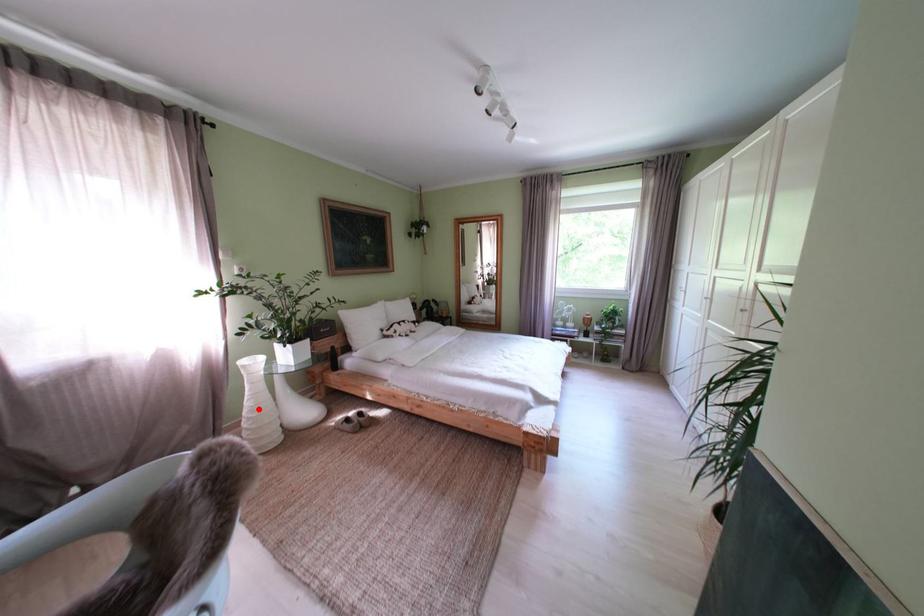
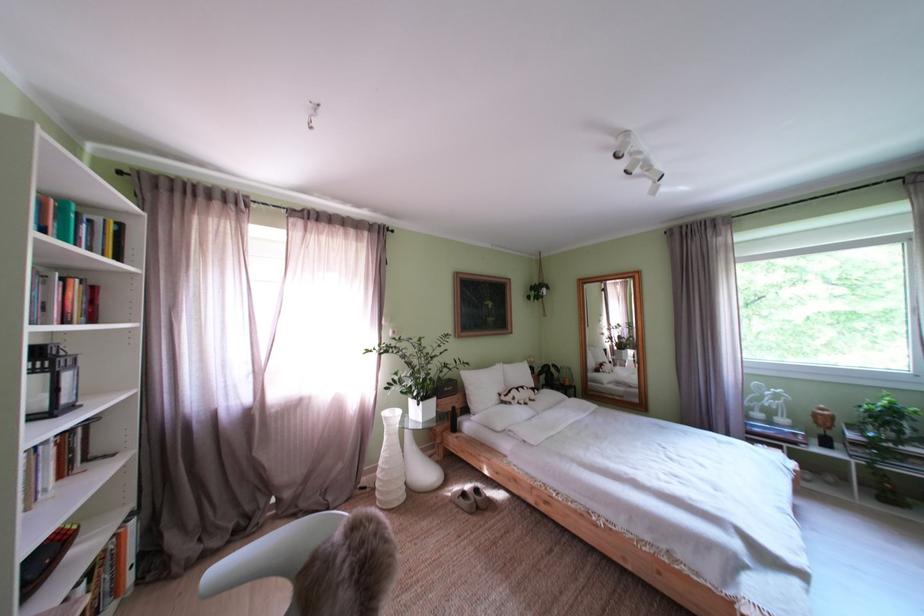
Question: I am providing you with two images of the same scene from different viewpoints. Image1 has a red point marked. In image2, the corresponding 3D location appears at what relative position? Reply with the corresponding letter.

Choices:
 (A) Closer
 (B) Farther

Answer: (B)